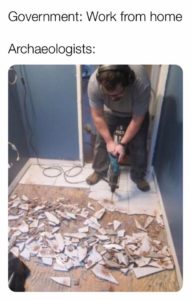
The image size is (191, 300). Find the location of `underflooring`. underflooring is located at coordinates (153, 286).